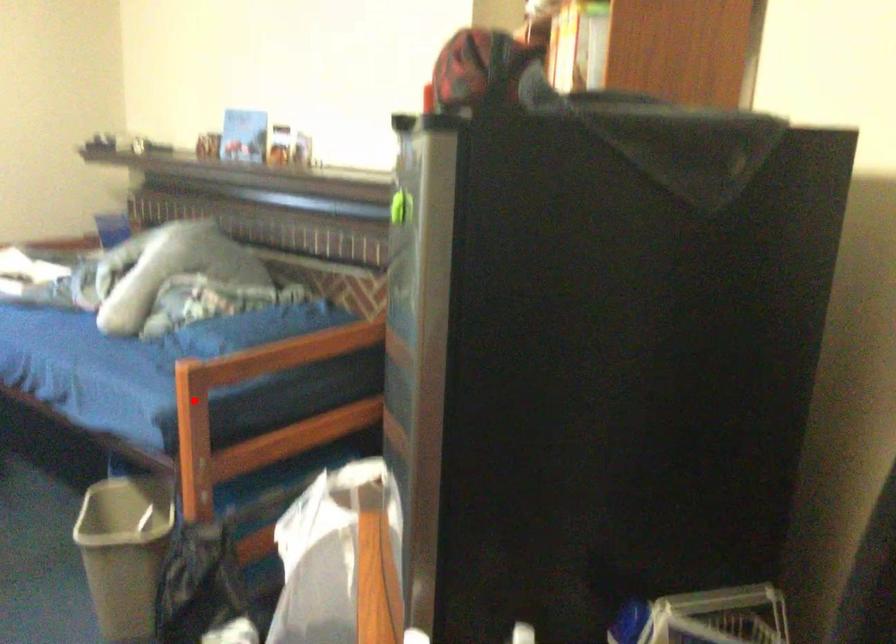
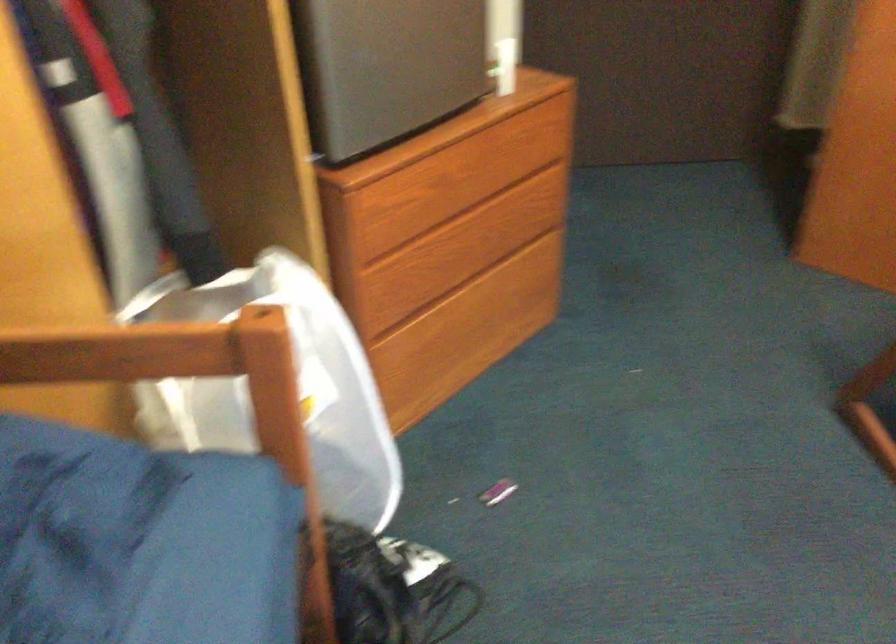
Locate, in the second image, the point that corresponds to the highlighted location in the first image.

(297, 386)